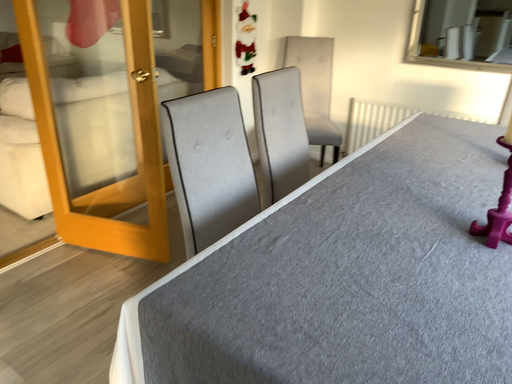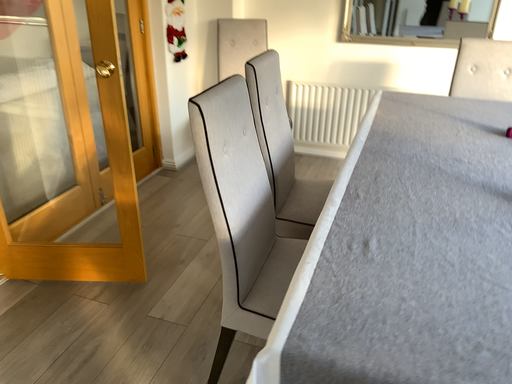
Question: How did the camera likely rotate when shooting the video?

Choices:
 (A) rotated left
 (B) rotated right

Answer: (B)